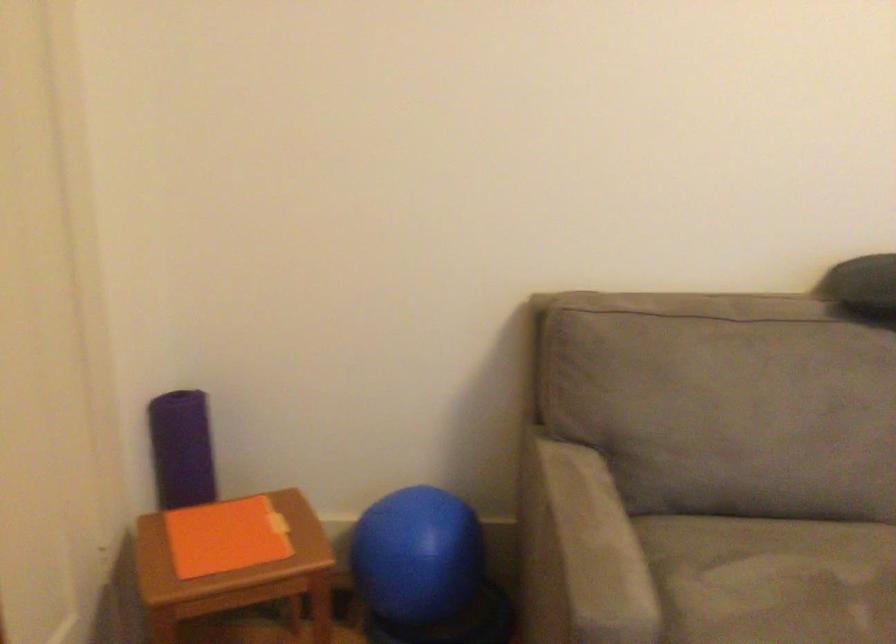
What do you see at coordinates (771, 579) in the screenshot?
I see `a sofa sitting surface` at bounding box center [771, 579].